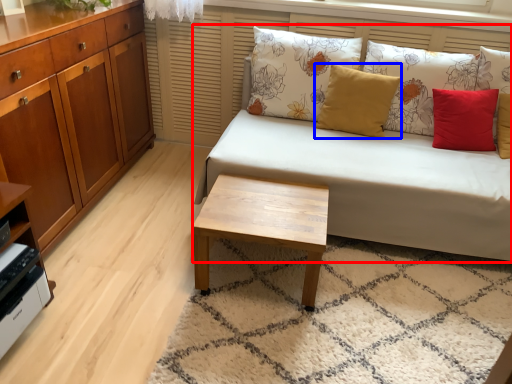
Question: Which object is further to the camera taking this photo, studio couch (highlighted by a red box) or pillow (highlighted by a blue box)?

Choices:
 (A) studio couch
 (B) pillow

Answer: (B)